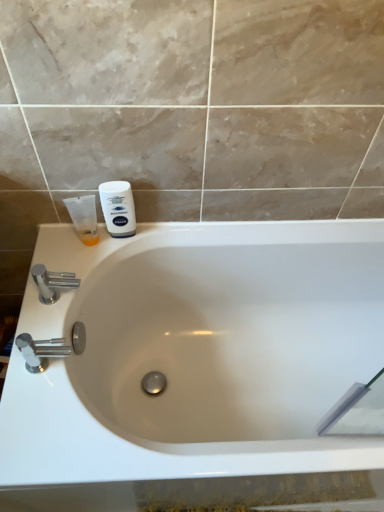
Where is `vacant space in front of polished chrome faucet at lower left, which appears as the first tap when viewed from the front`? vacant space in front of polished chrome faucet at lower left, which appears as the first tap when viewed from the front is located at coordinates (56, 423).